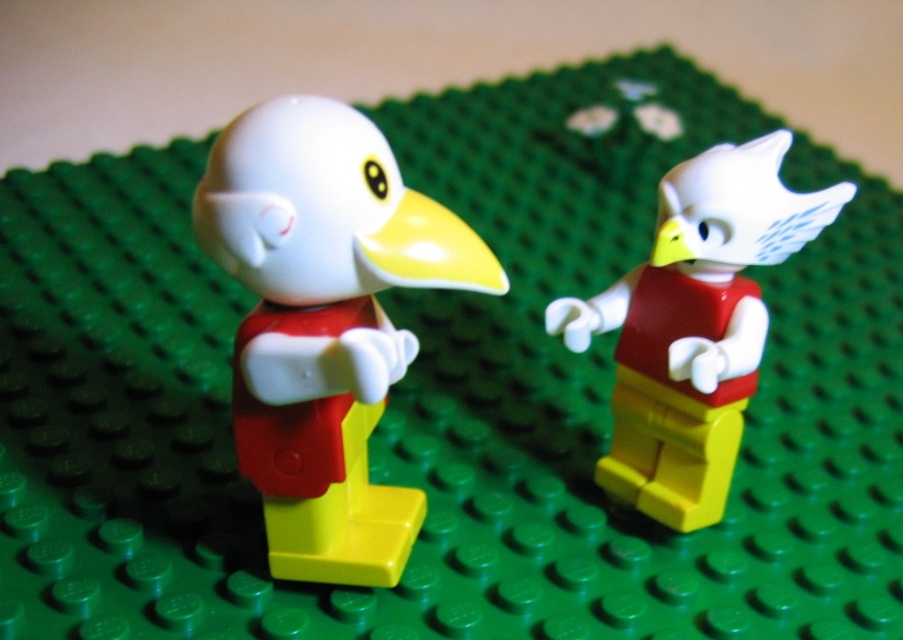
You are a LEGO builder examining the two figures. Which object is positioned closer to you, the matte plastic bird at center or the matte red torso at center?

The matte plastic bird at center is closer to the viewer than the matte red torso at center.

You are a bird enthusiast observing two LEGO bird minifigures on a green baseplate. You notice two specific points marked on the image at coordinates point (275, 259) and point (788, 244). Based on their positions, which point is closer to the front of the baseplate?

Point (275, 259) is in front of point (788, 244), so the point at (275, 259) is closer to the front of the baseplate.